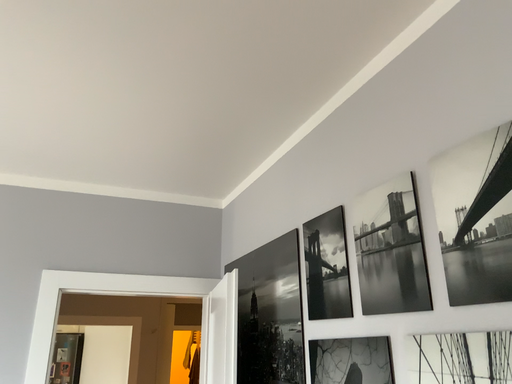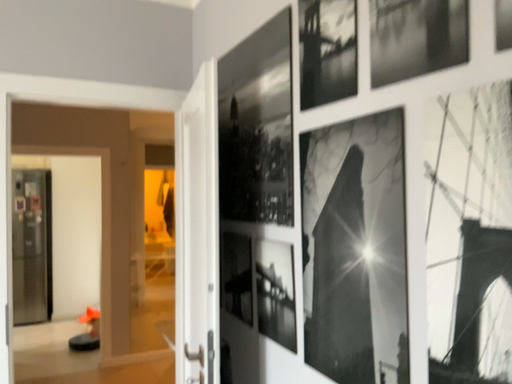
Question: How did the camera likely rotate when shooting the video?

Choices:
 (A) rotated upward
 (B) rotated downward

Answer: (B)